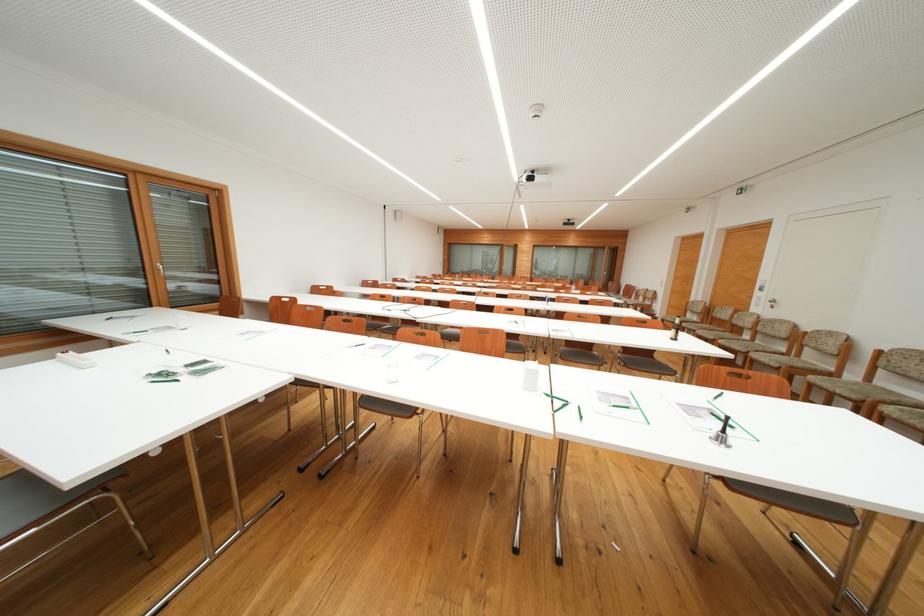
Identify the location of window handle. The width and height of the screenshot is (924, 616). (160, 268).